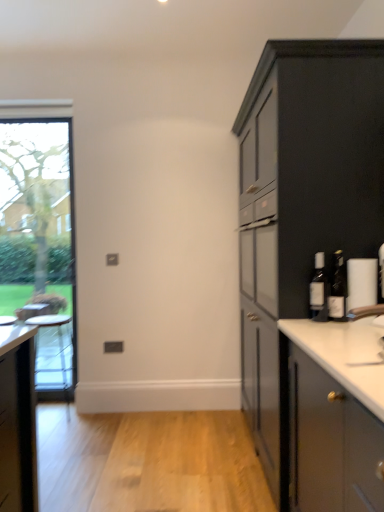
Question: From the image's perspective, does matte gray cabinet at right appear lower than matte glass bottle at right, marked as the 1th bottle in a right-to-left arrangement?

Choices:
 (A) no
 (B) yes

Answer: (A)

Question: Is matte gray cabinet at right outside of matte glass bottle at right, the second bottle when ordered from left to right?

Choices:
 (A) no
 (B) yes

Answer: (B)

Question: Considering the relative positions of matte gray cabinet at right and matte glass bottle at right, the second bottle when ordered from left to right, in the image provided, is matte gray cabinet at right in front of matte glass bottle at right, the second bottle when ordered from left to right,?

Choices:
 (A) yes
 (B) no

Answer: (B)

Question: Does matte gray cabinet at right appear on the right side of matte glass bottle at right, the second bottle when ordered from left to right?

Choices:
 (A) no
 (B) yes

Answer: (B)

Question: Does matte gray cabinet at right turn towards matte glass bottle at right, marked as the 1th bottle in a right-to-left arrangement?

Choices:
 (A) yes
 (B) no

Answer: (B)

Question: Would you say matte gray cabinet at right is to the left or to the right of translucent glass bottle at right, the second bottle viewed from the right, in the picture?

Choices:
 (A) right
 (B) left

Answer: (A)

Question: Is matte gray cabinet at right spatially inside translucent glass bottle at right, the second bottle viewed from the right, or outside of it?

Choices:
 (A) outside
 (B) inside

Answer: (A)

Question: From the image's perspective, is matte gray cabinet at right above or below translucent glass bottle at right, which is the first bottle from left to right?

Choices:
 (A) below
 (B) above

Answer: (B)

Question: Is matte gray cabinet at right in front of or behind translucent glass bottle at right, which is the first bottle from left to right, in the image?

Choices:
 (A) behind
 (B) front

Answer: (A)

Question: Is point (21, 234) closer or farther from the camera than point (319, 245)?

Choices:
 (A) closer
 (B) farther

Answer: (B)

Question: Is clear glass window at left spatially inside matte gray cabinet at right, or outside of it?

Choices:
 (A) inside
 (B) outside

Answer: (B)

Question: In the image, is clear glass window at left on the left side or the right side of matte gray cabinet at right?

Choices:
 (A) right
 (B) left

Answer: (B)

Question: From a real-world perspective, is clear glass window at left physically located above or below matte gray cabinet at right?

Choices:
 (A) above
 (B) below

Answer: (A)

Question: Relative to matte gray cabinet at right, is translucent glass bottle at right, the second bottle viewed from the right, in front or behind?

Choices:
 (A) front
 (B) behind

Answer: (A)

Question: From the image's perspective, is translucent glass bottle at right, which is the first bottle from left to right, located above or below matte gray cabinet at right?

Choices:
 (A) below
 (B) above

Answer: (A)